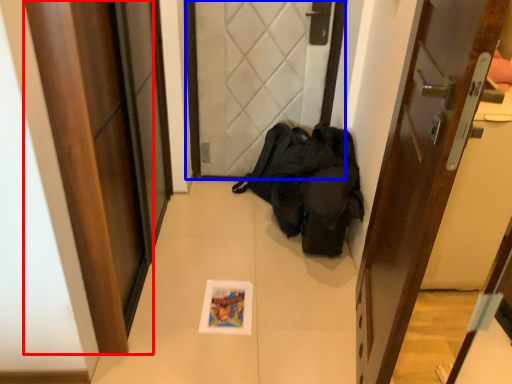
Question: Which object is closer to the camera taking this photo, door (highlighted by a red box) or door (highlighted by a blue box)?

Choices:
 (A) door
 (B) door

Answer: (A)